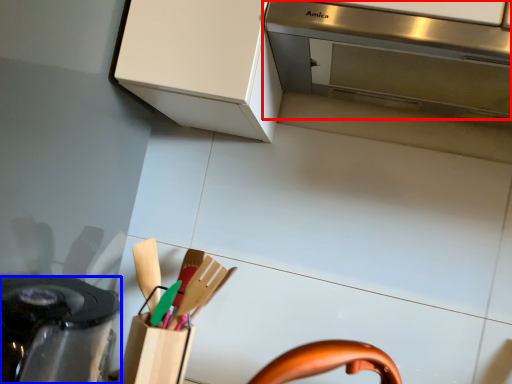
Question: Which object is closer to the camera taking this photo, home appliance (highlighted by a red box) or kitchen appliance (highlighted by a blue box)?

Choices:
 (A) home appliance
 (B) kitchen appliance

Answer: (B)